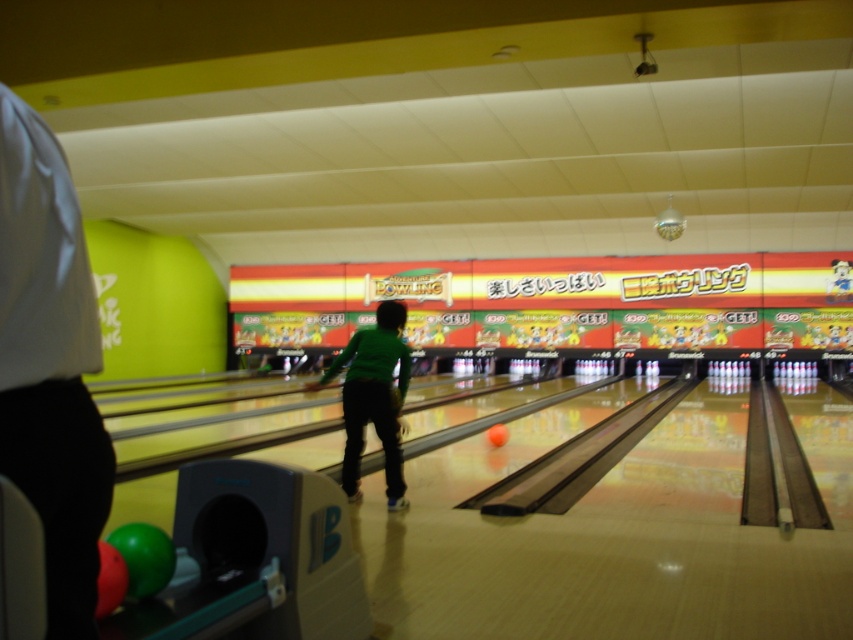
Question: Is white fabric shirt at left to the right of green matte shirt at center from the viewer's perspective?

Choices:
 (A) no
 (B) yes

Answer: (A)

Question: Which of the following is the farthest from the observer?

Choices:
 (A) white fabric shirt at left
 (B) green matte shirt at center

Answer: (B)

Question: Which of the following is the farthest from the observer?

Choices:
 (A) (378, 349)
 (B) (53, 534)

Answer: (A)

Question: Is white fabric shirt at left positioned in front of green matte shirt at center?

Choices:
 (A) no
 (B) yes

Answer: (B)

Question: Is white fabric shirt at left smaller than green matte shirt at center?

Choices:
 (A) no
 (B) yes

Answer: (B)